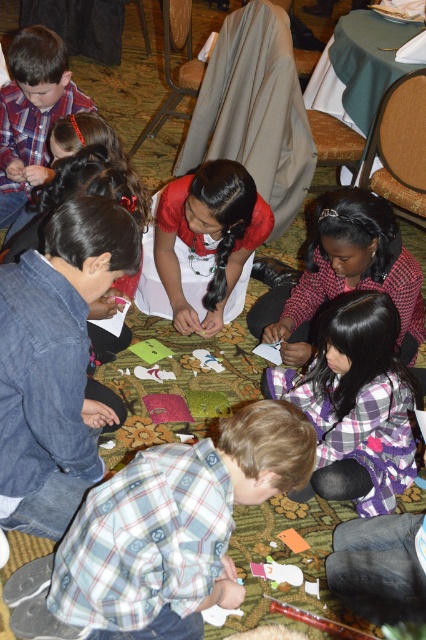
Is point (218, 192) behind point (48, 168)?

That is False.

Which is in front, point (138, 284) or point (46, 45)?

Positioned in front is point (46, 45).

Between point (232, 224) and point (11, 198), which one is positioned in front?

Point (232, 224) is more forward.

Identify the location of matte red blouse at center. (204, 244).

Is purple plaid shirt at lower center wider than matte plaid shirt at upper left?

Incorrect, purple plaid shirt at lower center's width does not surpass matte plaid shirt at upper left's.

Identify the location of purple plaid shirt at lower center. (356, 403).

In the scene shown: Can you confirm if matte red shirt at center is positioned below matte plaid shirt at upper left?

Yes, matte red shirt at center is below matte plaid shirt at upper left.

From the picture: Can you confirm if matte red shirt at center is thinner than matte plaid shirt at upper left?

Incorrect, matte red shirt at center's width is not less than matte plaid shirt at upper left's.

Identify the location of matte red shirt at center. This screenshot has width=426, height=640. (345, 275).